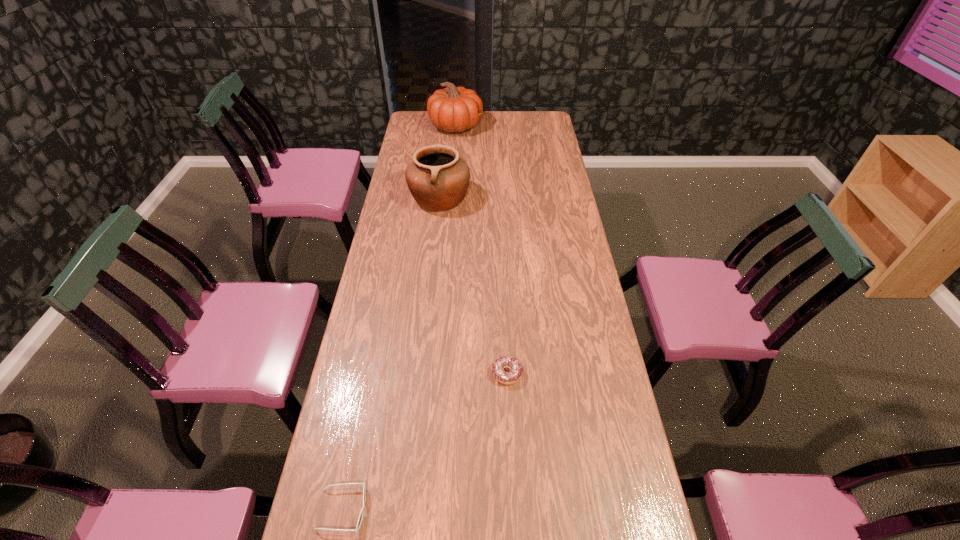
This screenshot has height=540, width=960. What are the coordinates of `pumpkin present at the left edge` in the screenshot? It's located at (453, 109).

Image resolution: width=960 pixels, height=540 pixels. Find the location of `pottery present at the left edge`. pottery present at the left edge is located at coordinates (438, 179).

Find the location of `sunglasses positioned at the left edge`. sunglasses positioned at the left edge is located at coordinates (360, 518).

The image size is (960, 540). In order to click on object situated at the far left corner in this screenshot , I will do `click(453, 109)`.

Locate an element on the screen. The image size is (960, 540). free space at the left edge is located at coordinates (431, 132).

Identify the location of free spot at the right edge of the desktop. The width and height of the screenshot is (960, 540). (553, 170).

Where is `free space between the sunglasses and the farthest object`? free space between the sunglasses and the farthest object is located at coordinates (399, 318).

I want to click on unoccupied position between the nearest object and the farthest object, so click(399, 318).

Locate an element on the screen. vacant space that is in between the second nearest object and the nearest object is located at coordinates (424, 441).

Where is `free space between the second farthest object and the rightmost object`? free space between the second farthest object and the rightmost object is located at coordinates (473, 286).